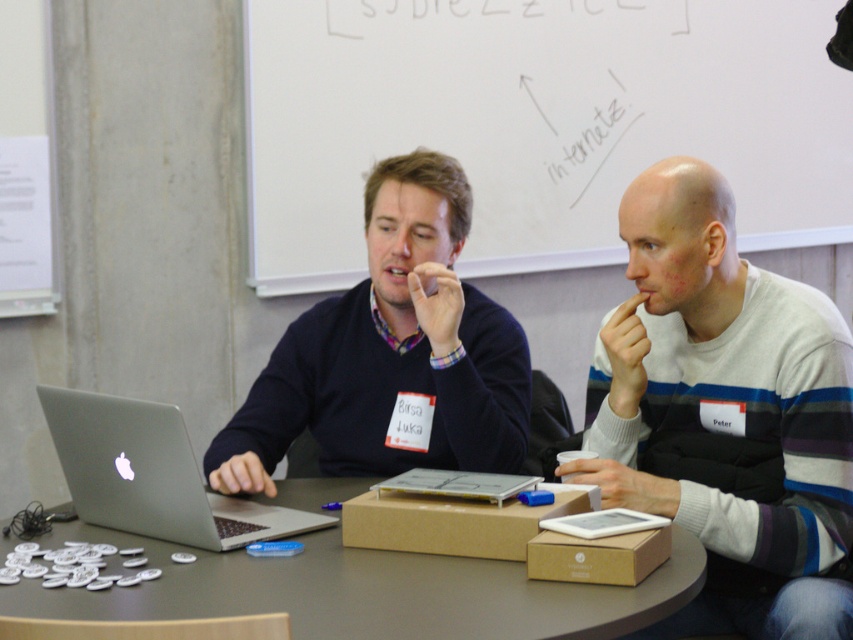
You are standing in front of the table where two people are sitting. You want to write a note on the whiteboard at upper center. In which direction should you move to reach it?

The whiteboard at upper center is located at point (537, 122), so you should move towards the upper center direction to reach it.

You are trying to place a new item on the table between the two people. The item is wider than the distance between the white striped sweater at center and the matte brown cardboard box at center. Where should you place it?

Answer: Since the white striped sweater at center is to the right of the matte brown cardboard box at center, you should place the item to the left of the matte brown cardboard box at center or to the right of the white striped sweater at center to ensure it fits.